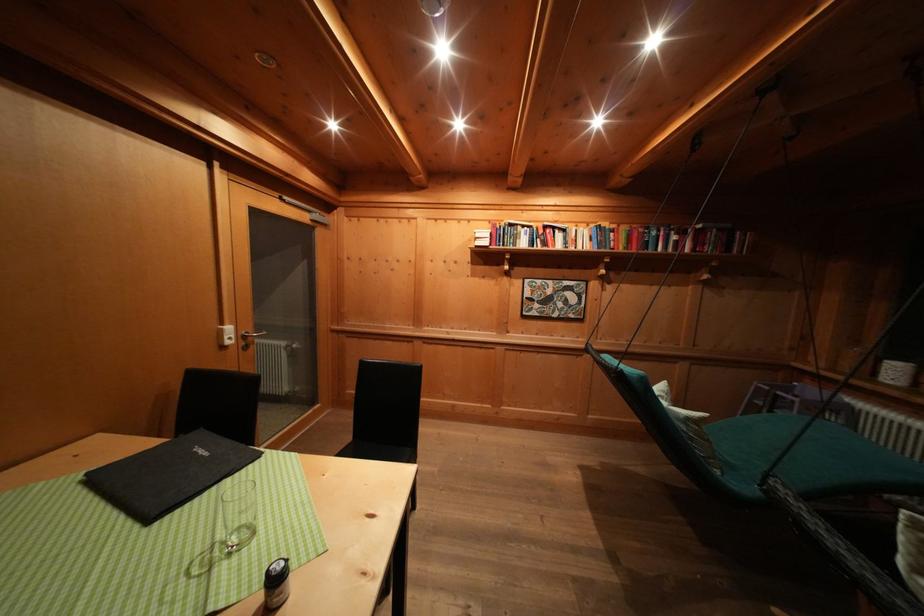
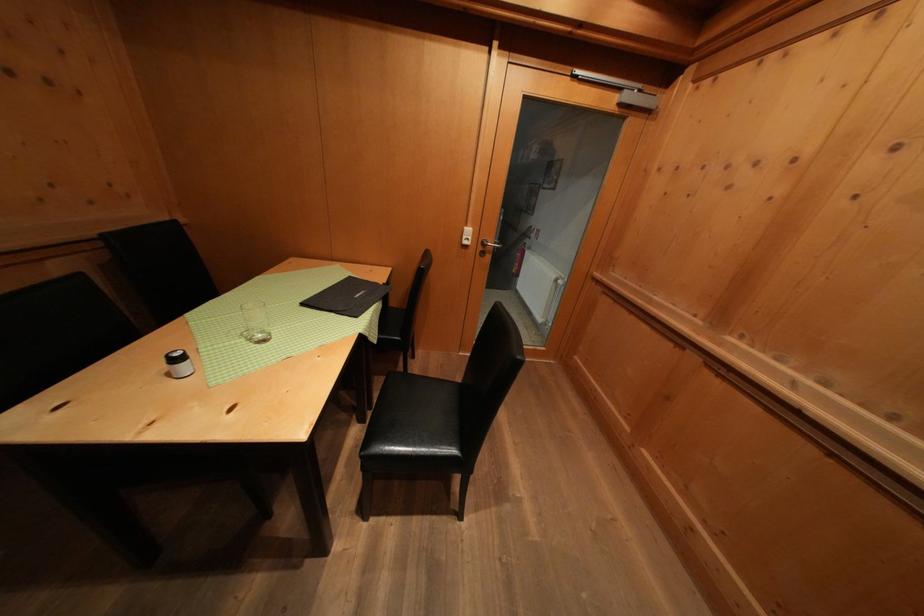
In the second image, find the point that corresponds to (250,342) in the first image.

(490, 249)